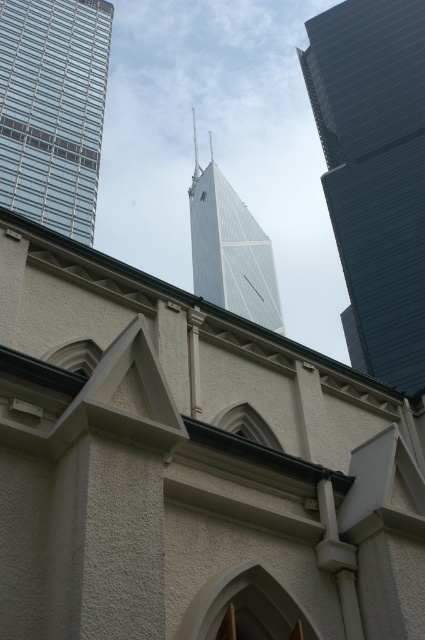
Can you confirm if glassy steel skyscraper at upper left is thinner than white glass tower at center?

No.

The image size is (425, 640). What do you see at coordinates (53, 109) in the screenshot?
I see `glassy steel skyscraper at upper left` at bounding box center [53, 109].

Is point (39, 118) positioned before point (195, 256)?

Yes, point (39, 118) is in front of point (195, 256).

At what (x,y) coordinates should I click in order to perform the action: click on glassy steel skyscraper at upper left. Please return your answer as a coordinate pair (x, y). The height and width of the screenshot is (640, 425). Looking at the image, I should click on (53, 109).

Between point (357, 291) and point (272, 264), which one is positioned behind?

The point (272, 264) is more distant.

Does dark blue glass skyscraper at right appear on the right side of white glass tower at center?

Yes, dark blue glass skyscraper at right is to the right of white glass tower at center.

Is point (365, 326) positioned in front of point (232, 310)?

Yes, it is in front of point (232, 310).

At what (x,y) coordinates should I click in order to perform the action: click on dark blue glass skyscraper at right. Please return your answer as a coordinate pair (x, y). Looking at the image, I should click on 374,170.

Does dark blue glass skyscraper at right have a smaller size compared to glassy steel skyscraper at upper left?

Correct, dark blue glass skyscraper at right occupies less space than glassy steel skyscraper at upper left.

Does dark blue glass skyscraper at right appear on the right side of glassy steel skyscraper at upper left?

Indeed, dark blue glass skyscraper at right is positioned on the right side of glassy steel skyscraper at upper left.

Is point (393, 147) positioned after point (50, 125)?

That is False.

Identify the location of dark blue glass skyscraper at right. Image resolution: width=425 pixels, height=640 pixels. (374, 170).